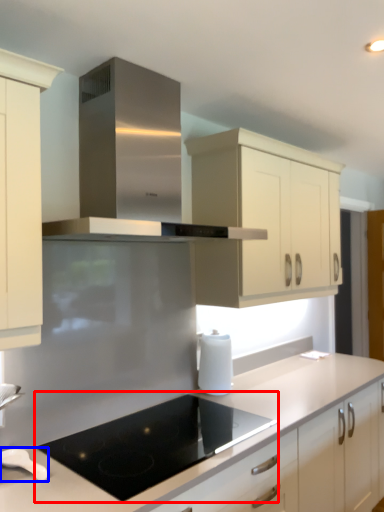
Question: Which object appears closest to the camera in this image, gas stove (highlighted by a red box) or kitchen appliance (highlighted by a blue box)?

Choices:
 (A) gas stove
 (B) kitchen appliance

Answer: (A)